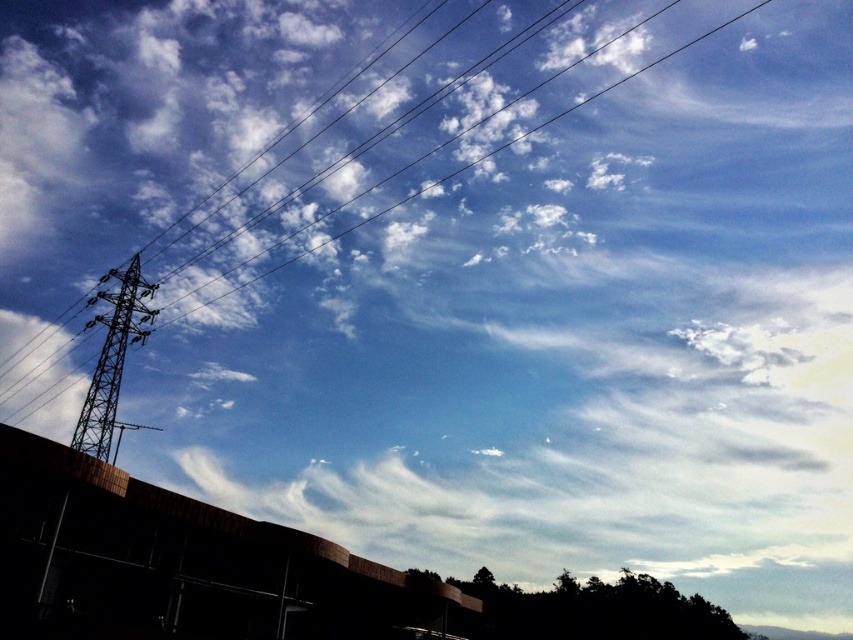
You are a maintenance worker inspecting the structure in the image. You notice the metallic structure at left and the metallic wire at upper left. Which object is located below the other?

The metallic structure at left is positioned under the metallic wire at upper left, so the metallic structure at left is below the metallic wire at upper left.

You are standing in front of the building with a curved roofline and looking at the two points in the sky. Which point is closer to you, point (115, 310) or point (169, 305)?

Point (115, 310) is in front of point (169, 305), so it is closer to you.